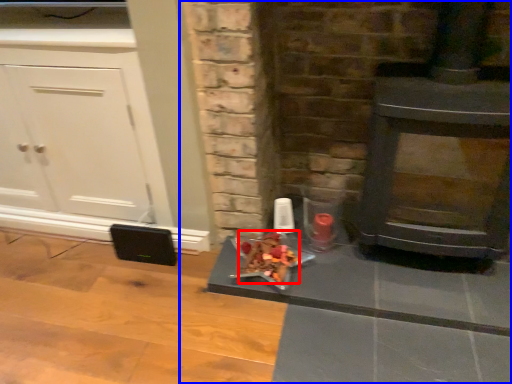
Question: Which of the following is the farthest to the observer, food (highlighted by a red box) or fireplace (highlighted by a blue box)?

Choices:
 (A) food
 (B) fireplace

Answer: (A)